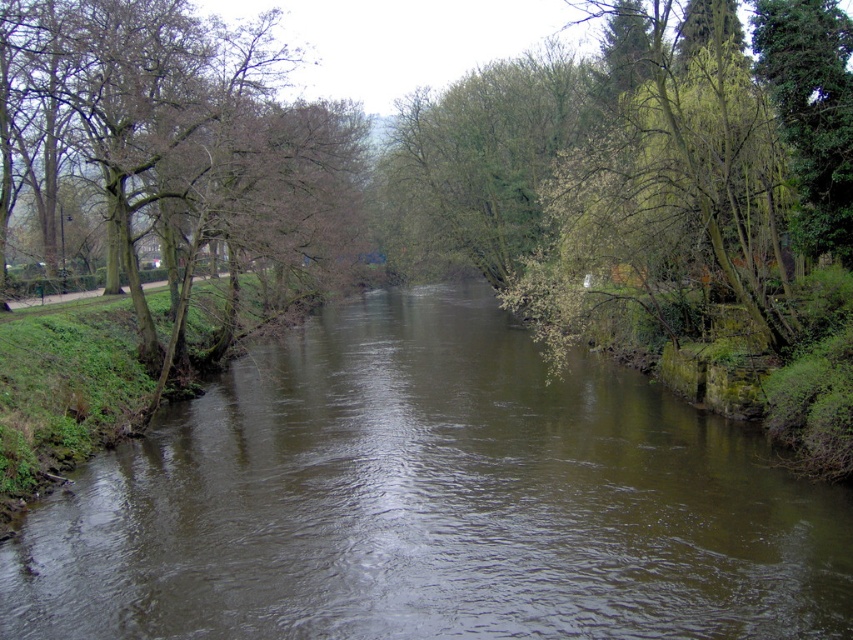
Between brown muddy stream at center and brown leafy tree at left, which one appears on the left side from the viewer's perspective?

brown leafy tree at left is more to the left.

Between brown muddy stream at center and brown leafy tree at left, which one has more height?

brown leafy tree at left is taller.

This screenshot has width=853, height=640. Describe the element at coordinates (431, 500) in the screenshot. I see `brown muddy stream at center` at that location.

I want to click on brown muddy stream at center, so click(431, 500).